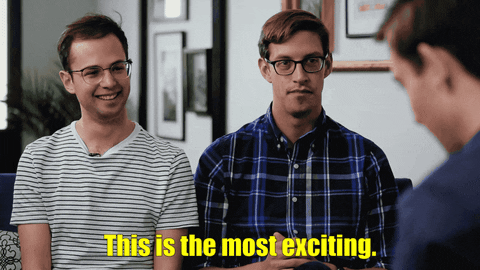
The width and height of the screenshot is (480, 270). Find the location of `window`. window is located at coordinates (1, 25).